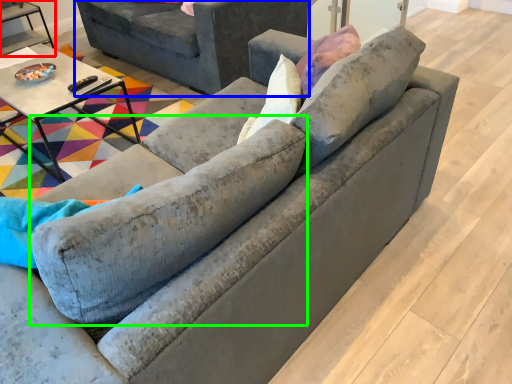
Question: Estimate the real-world distances between objects in this image. Which object is farther from table (highlighted by a red box), studio couch (highlighted by a blue box) or swivel chair (highlighted by a green box)?

Choices:
 (A) studio couch
 (B) swivel chair

Answer: (B)